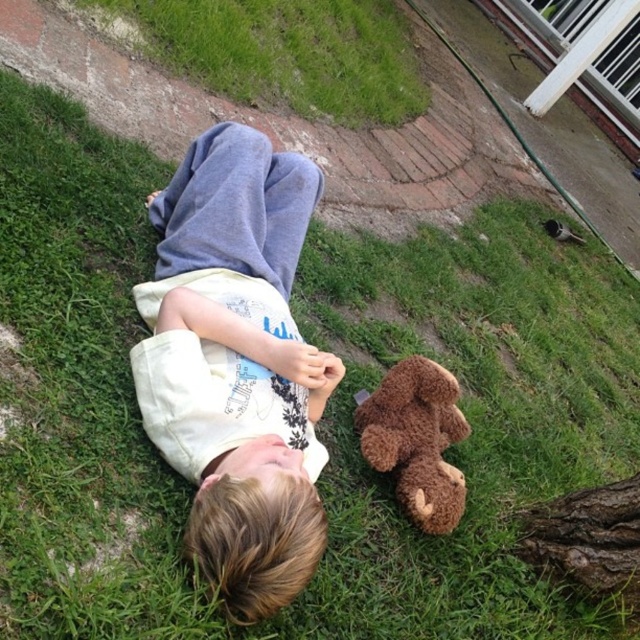
You are a photographer trying to capture a closeup of the black fuzzy bird at upper right. The white cotton shirt at center is blocking your view. Can you estimate whether the shirt is wider than the bird?

The white cotton shirt at center has a width larger than the black fuzzy bird at upper right, so the shirt is wider and blocking the view.

You are a photographer setting up a shot of the scene. You want to position a prop to the right of the green grass at upper left. Where should you place it in relation to the white cotton shirt at center?

Place the prop to the right of the green grass at upper left, which would be to the right of the white cotton shirt at center since the white cotton shirt at center is to the left of green grass at upper left.